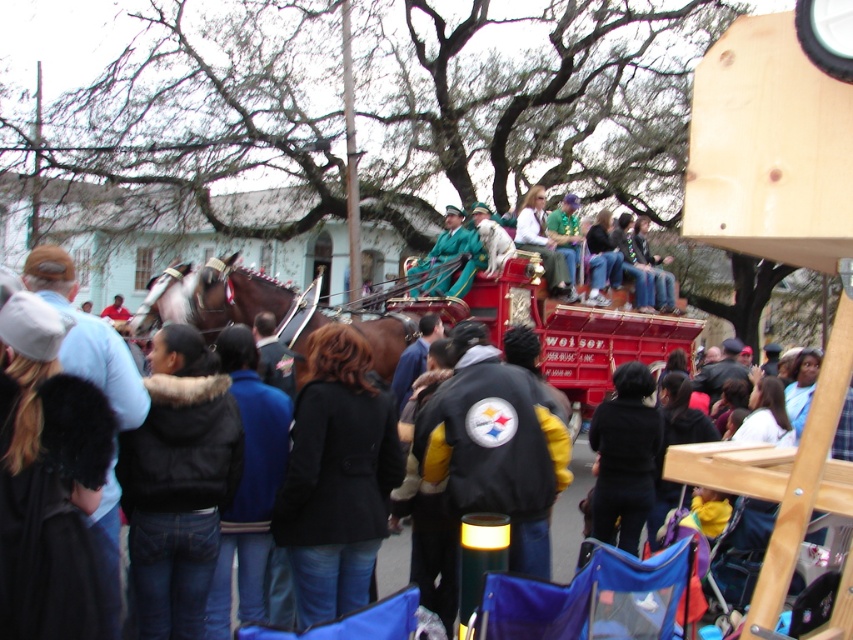
Question: Is black fuzzy vest at center positioned in front of green velvet coat at center?

Choices:
 (A) no
 (B) yes

Answer: (B)

Question: Is black fuzzy vest at center positioned before shiny brown horse at left?

Choices:
 (A) yes
 (B) no

Answer: (A)

Question: Based on their relative distances, which object is nearer to the shiny brown horse at left?

Choices:
 (A) green velvet jacket at center
 (B) black wool coat at center
 (C) black fuzzy vest at center
 (D) brown glossy horse at center

Answer: (D)

Question: Considering the real-world distances, which object is farthest from the green velvet jacket at center?

Choices:
 (A) green velvet coat at center
 (B) brown glossy horse at center
 (C) shiny brown horse at left
 (D) black fuzzy vest at center

Answer: (D)

Question: Is brown glossy horse at center bigger than shiny brown horse at left?

Choices:
 (A) no
 (B) yes

Answer: (B)

Question: Which object appears farthest from the camera in this image?

Choices:
 (A) black wool coat at center
 (B) shiny brown horse at left
 (C) black fuzzy vest at center
 (D) brown glossy horse at center

Answer: (D)